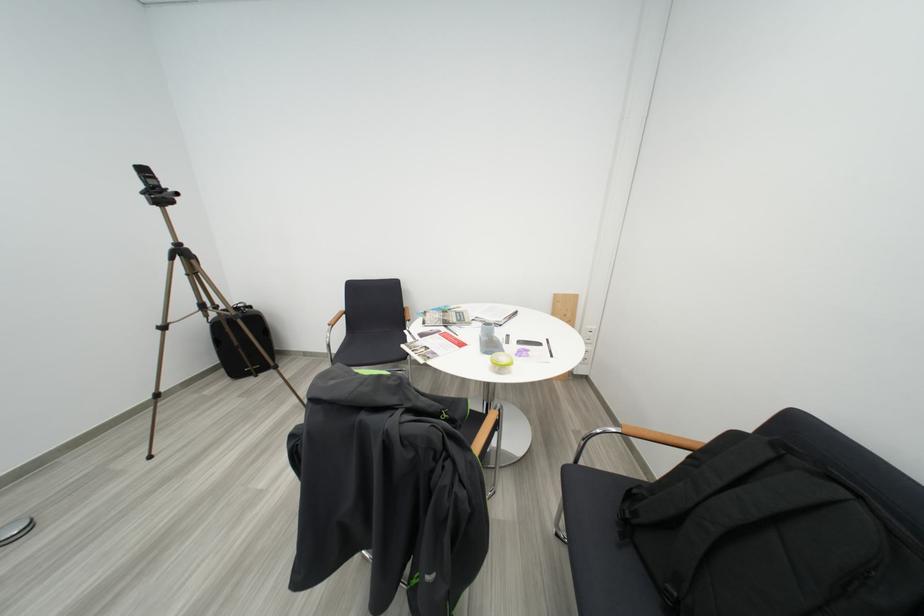
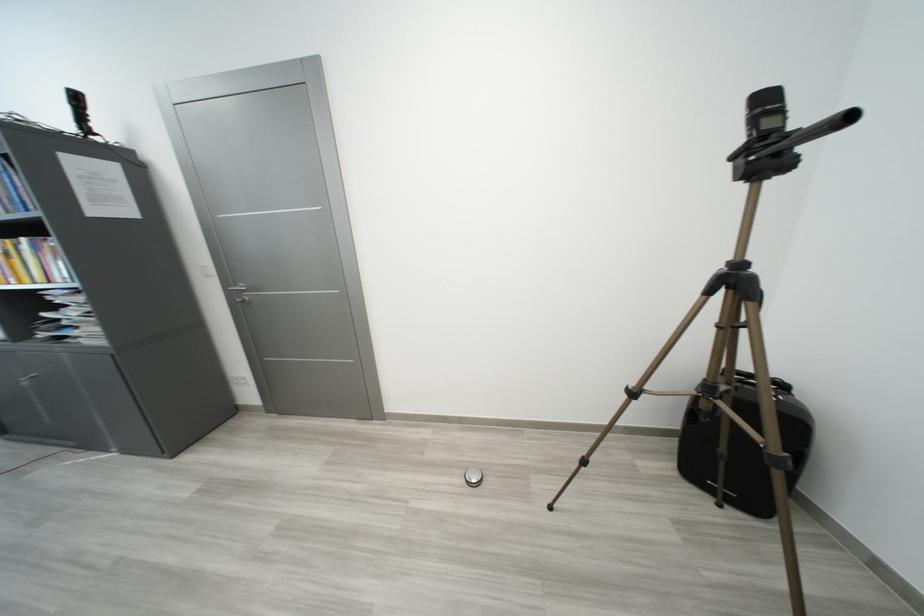
In the second image, find the point that corresponds to (168,326) in the first image.

(640, 387)